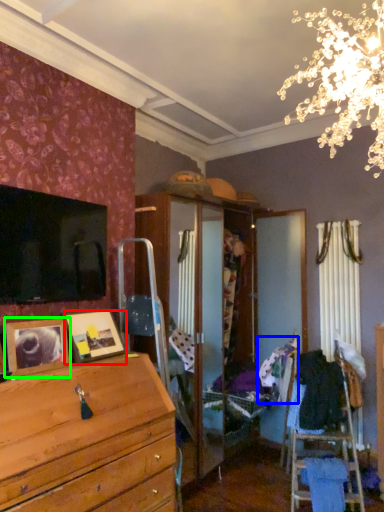
Question: Considering the real-world distances, which object is closest to picture frame (highlighted by a red box)? clothing (highlighted by a blue box) or picture frame (highlighted by a green box).

Choices:
 (A) clothing
 (B) picture frame

Answer: (B)